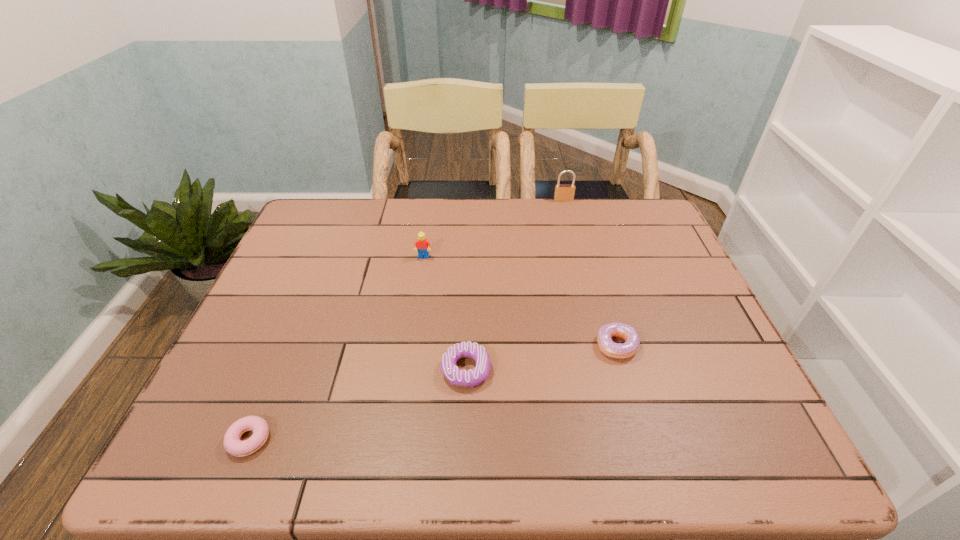
I want to click on free space at the right edge of the desktop, so click(x=661, y=272).

You are a GUI agent. You are given a task and a screenshot of the screen. Output one action in this format:
    pyautogui.click(x=<x>, y=<y>)
    Task: Click on the free region at the far right corner
    The image size is (960, 540).
    Given the screenshot: What is the action you would take?
    pyautogui.click(x=617, y=211)

Locate an element on the screen. The height and width of the screenshot is (540, 960). free spot between the rightmost doughnut and the nearest object is located at coordinates (433, 393).

Identify the location of unoccupied area between the padlock and the third object from right to left. (515, 285).

Identify the location of free area in between the tallest object and the shortest object. This screenshot has width=960, height=540. (406, 320).

At what (x,y) coordinates should I click in order to perform the action: click on free space that is in between the nearest doughnut and the third object from right to left. Please return your answer as a coordinate pair (x, y). This screenshot has height=540, width=960. Looking at the image, I should click on (357, 405).

Where is `free space that is in between the Lego and the rightmost doughnut`? free space that is in between the Lego and the rightmost doughnut is located at coordinates (520, 301).

Where is `free point between the rightmost doughnut and the padlock`? free point between the rightmost doughnut and the padlock is located at coordinates (590, 273).

This screenshot has height=540, width=960. What are the coordinates of `free space between the tallest object and the second doughnut from right to left` in the screenshot? It's located at (515, 285).

Identify the location of vacant space in between the rightmost doughnut and the leftmost object. (433, 393).